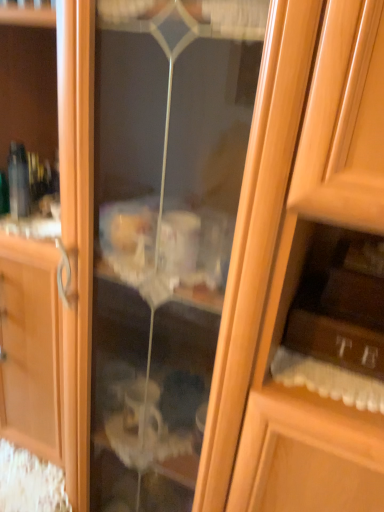
The image size is (384, 512). What do you see at coordinates (335, 342) in the screenshot?
I see `wooden drawer at lower right` at bounding box center [335, 342].

Measure the distance between point (355, 361) and camera.

Point (355, 361) and camera are 31.34 inches apart.

You are a GUI agent. You are given a task and a screenshot of the screen. Output one action in this format:
    pyautogui.click(x=<x>, y=<y>)
    Task: Click on the wooden drawer at lower right
    
    Given the screenshot: What is the action you would take?
    pyautogui.click(x=335, y=342)

Find the location of a particular element. wooden drawer at lower right is located at coordinates (335, 342).